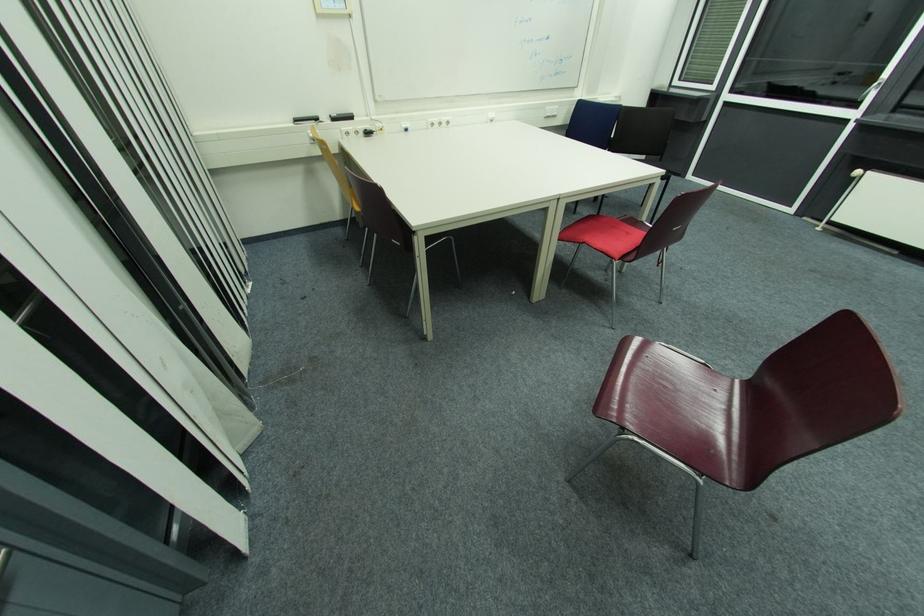
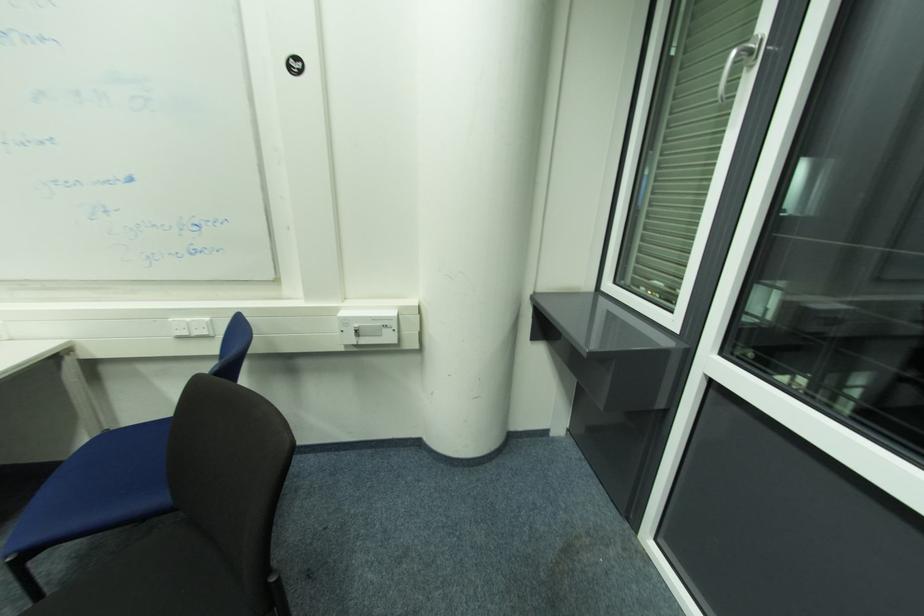
What movement of the cameraman would produce the second image?

The cameraman walked toward right, forward.